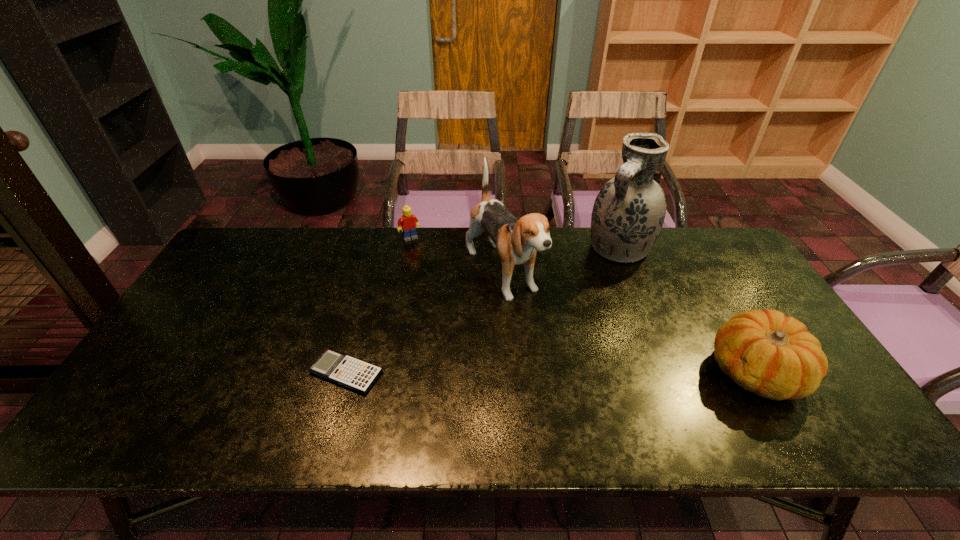
Find the location of a particular element. The image size is (960, 540). calculator that is at the near edge is located at coordinates (347, 371).

Where is `gourd located at the near edge`? gourd located at the near edge is located at coordinates (765, 352).

Identify the location of object situated at the right edge. (765, 352).

Identify the location of object positioned at the near right corner. (765, 352).

The height and width of the screenshot is (540, 960). In order to click on vacant space at the far edge in this screenshot , I will do `click(593, 269)`.

Find the location of `free region at the near edge`. free region at the near edge is located at coordinates (552, 380).

Find the location of `free spot at the left edge of the desktop`. free spot at the left edge of the desktop is located at coordinates (238, 298).

Where is `free location at the far left corner of the desktop`? free location at the far left corner of the desktop is located at coordinates (258, 254).

Where is `free space at the far right corner of the desktop`? This screenshot has width=960, height=540. free space at the far right corner of the desktop is located at coordinates pyautogui.click(x=712, y=240).

This screenshot has width=960, height=540. I want to click on vacant space in between the gourd and the Lego, so click(583, 305).